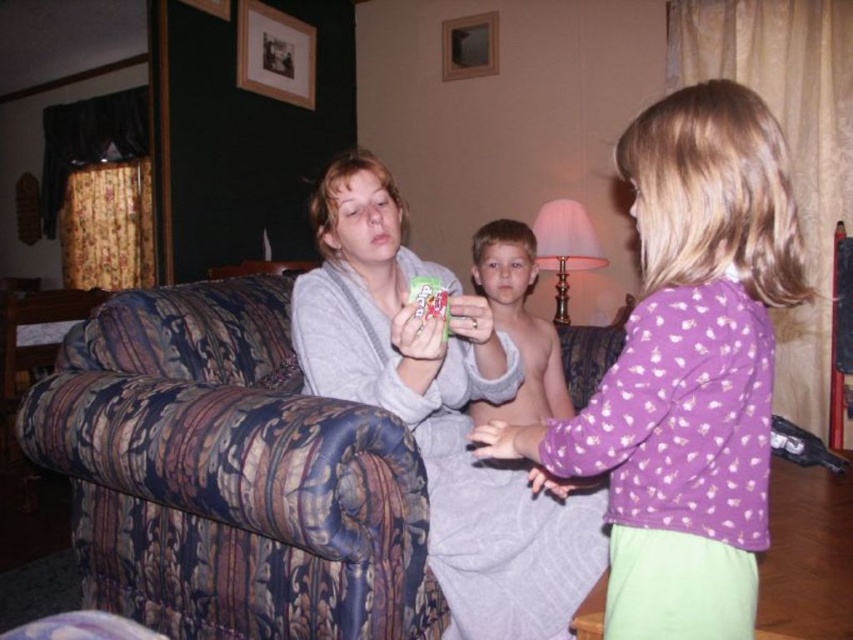
Consider the image. You are standing in the living room and want to reach a point that is exactly 3.39 feet away from the camera. Can you confirm if the point at coordinates point (618, 513) is the correct location?

Yes, the point at coordinates point (618, 513) is exactly 3.39 feet away from the camera, so it is the correct location.

You are organizing a closet and need to decide whether the purple cotton shirt at center can be folded and placed under the gray soft blanket at center. Based on their thickness, will the shirt fit underneath the blanket?

The purple cotton shirt at center is thinner than the gray soft blanket at center, so it can be folded and placed underneath the blanket without any issues.